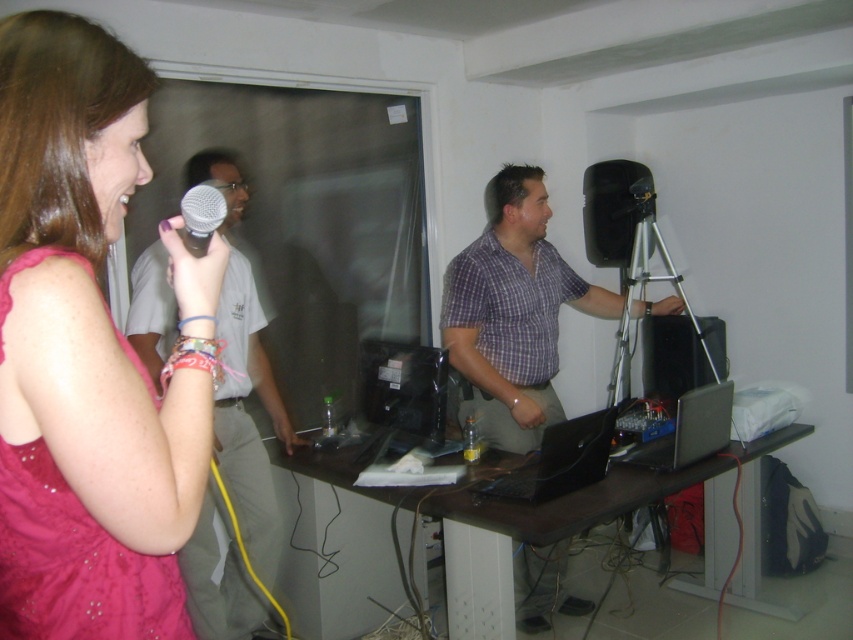
Based on the scene description, where is the light gray shirt at center located?

The light gray shirt at center is located at point 0.653 on the x axis and 0.292 on the y axis.

You are a photographer setting up for a photoshoot in the room. You need to position a large reflector behind the pink satin dress at upper left and the brown wooden table at center. Based on their positions, where should you place the reflector to best illuminate both objects?

The pink satin dress at upper left is located above the brown wooden table at center, so placing the reflector behind the pink satin dress at upper left would illuminate both objects effectively.

You are standing at the point labeled point (543,324) and want to move to the point labeled point (572,432). According to the scene description, will you need to walk forward or backward to reach your destination?

Since point (543,324) is behind point (572,432), you would need to walk forward to reach point (572,432) from your current position at point (543,324).